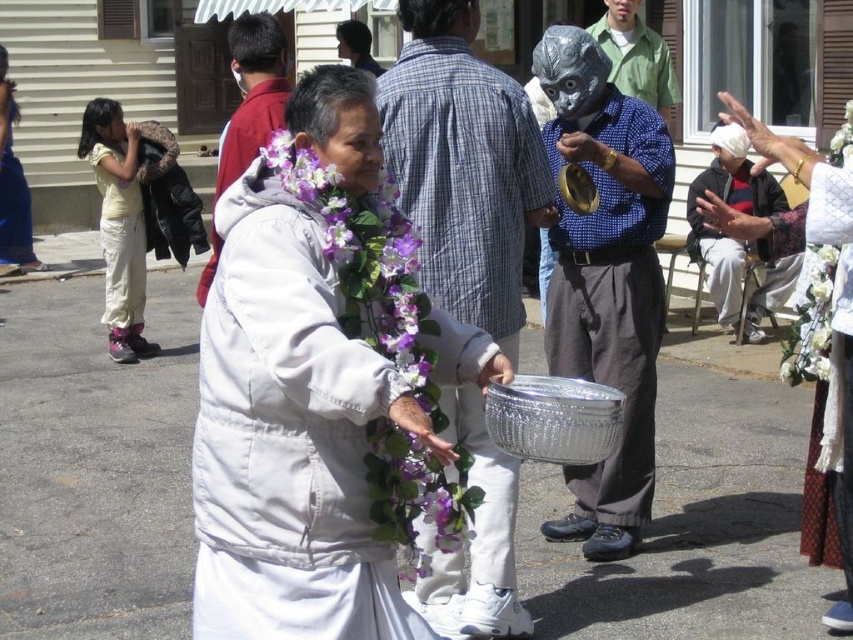
You are attending a cultural event and notice two white fabrics in the scene. The first is a white fabric shirt at right, and the second is a white fabric at center. Which of these two white fabrics is larger in size?

The white fabric shirt at right is bigger than the white fabric at center.

You are attending a cultural event and see two white fabrics in the scene. The first is a white fabric shirt at right, and the second is a white fabric at center. Which of these two white fabrics appears taller in the image?

The white fabric shirt at right appears taller than the white fabric at center according to the description.